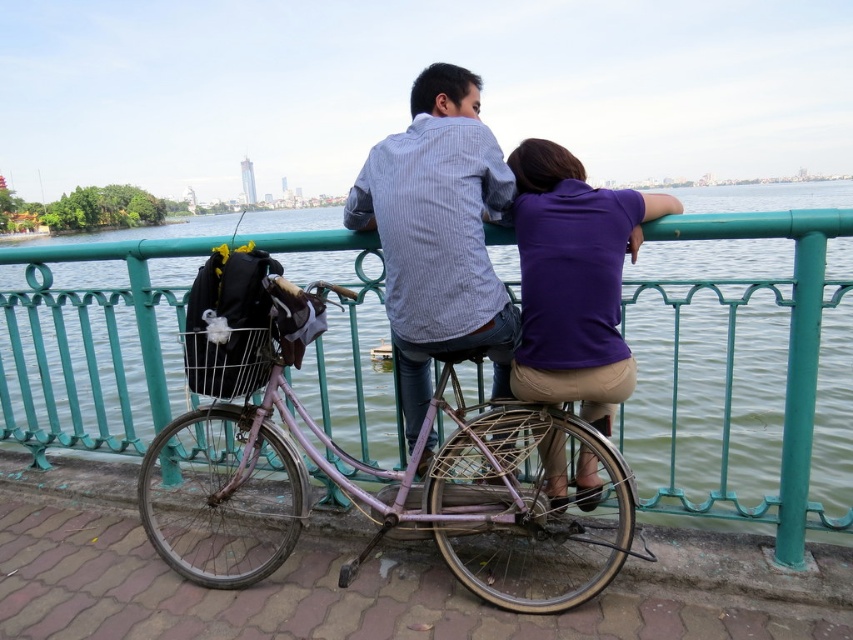
You are standing at the edge of the walkway and want to place a small potted plant exactly where the green metal railing at upper center is located. Is this possible?

The green metal railing at upper center is located at point coordinates of (743, 355), so placing a potted plant there would not be feasible since the railing is an obstacle occupying that space.

You are a painter standing at the green metal railing at upper center, and you want to paint the striped cotton shirt at center. If your brush can only reach 30 meters, will you be able to paint it?

The distance between the green metal railing at upper center and the striped cotton shirt at center is 29.88 meters, so yes, the painter can paint the striped cotton shirt at center because the distance is within the brush reach of 30 meters.

You are standing at the point labeled with coordinates (743, 355) in the image. What object are you directly facing?

The point labeled with coordinates (743, 355) indicates the green metal railing at upper center, so you are directly facing the green metal railing at upper center.